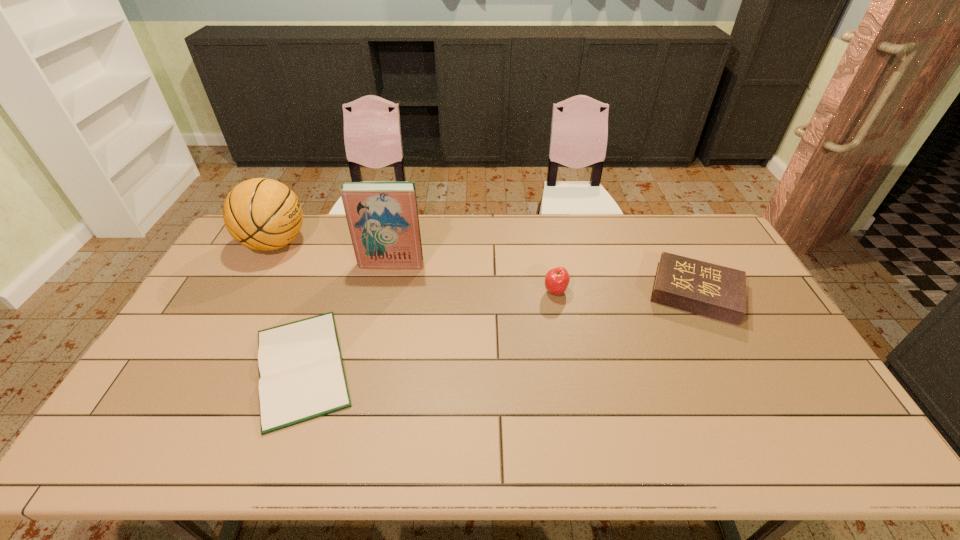
Where is `blank area located on the front of the second shortest hardback book`? blank area located on the front of the second shortest hardback book is located at coordinates (723, 347).

The image size is (960, 540). I want to click on vacant space located on the back of the shortest hardback book, so click(341, 256).

What are the coordinates of `object at the far edge` in the screenshot? It's located at (263, 214).

This screenshot has height=540, width=960. In order to click on object located at the near edge in this screenshot , I will do `click(301, 374)`.

Where is `object that is at the left edge`? The image size is (960, 540). object that is at the left edge is located at coordinates (263, 214).

Find the location of a particular element. This screenshot has width=960, height=540. object present at the right edge is located at coordinates click(714, 291).

This screenshot has height=540, width=960. I want to click on object at the far left corner, so click(x=263, y=214).

Find the location of a particular element. The width and height of the screenshot is (960, 540). vacant area at the far edge is located at coordinates (425, 254).

Where is `vacant space at the near edge of the desktop`? The image size is (960, 540). vacant space at the near edge of the desktop is located at coordinates [756, 429].

This screenshot has width=960, height=540. In the image, there is a desktop. Identify the location of free region at the left edge. (167, 421).